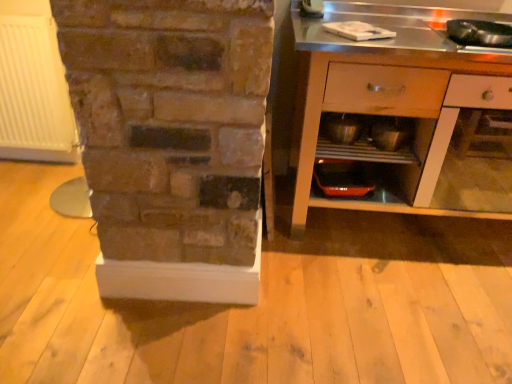
This screenshot has width=512, height=384. I want to click on vacant space in front of metallic silver cabinet at right, so click(x=400, y=303).